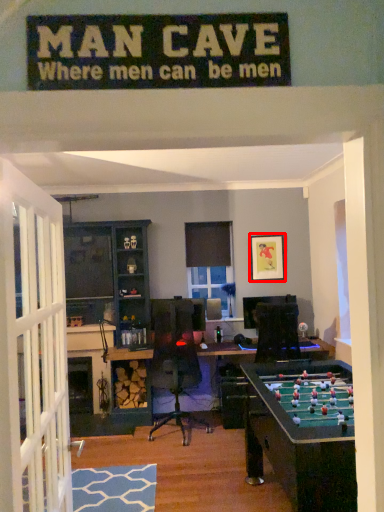
Question: From the image's perspective, considering the relative positions of picture frame (annotated by the red box) and entertainment center in the image provided, where is picture frame (annotated by the red box) located with respect to the staircase?

Choices:
 (A) below
 (B) above

Answer: (B)